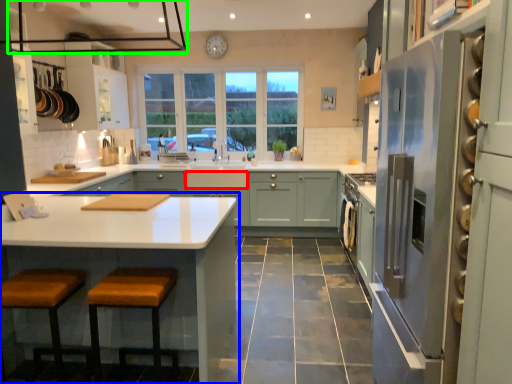
Question: Which object is positioned closest to drawer (highlighted by a red box)? Select from cabinetry (highlighted by a blue box) and exhaust hood (highlighted by a green box).

Choices:
 (A) cabinetry
 (B) exhaust hood

Answer: (B)